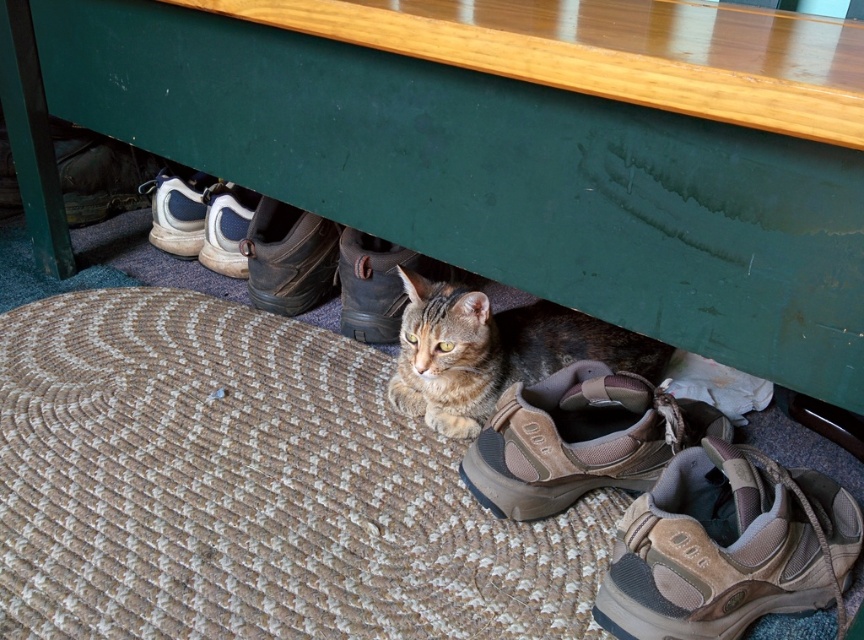
Question: Estimate the real-world distances between objects in this image. Which object is closer to the white suede shoe at lower left?

Choices:
 (A) white leather shoe at left
 (B) brown suede shoe at lower right

Answer: (A)

Question: Which point is closer to the camera taking this photo?

Choices:
 (A) (573, 397)
 (B) (678, 225)
 (C) (731, 500)

Answer: (B)

Question: Which object is the closest to the tabby fur cat under table?

Choices:
 (A) brown suede shoe at lower right
 (B) brown suede shoe at center
 (C) white leather shoe at left

Answer: (B)

Question: Is green painted wood table at center wider than brown suede shoe at center?

Choices:
 (A) no
 (B) yes

Answer: (B)

Question: Considering the relative positions of green painted wood table at center and brown suede shoe at center in the image provided, where is green painted wood table at center located with respect to brown suede shoe at center?

Choices:
 (A) left
 (B) right

Answer: (A)

Question: Is brown suede shoe at lower center closer to camera compared to brown leather boot at center?

Choices:
 (A) no
 (B) yes

Answer: (B)